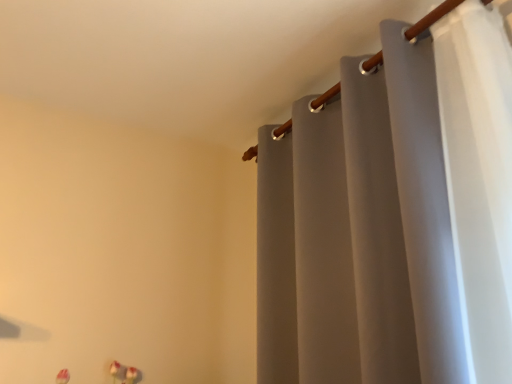
I want to click on matte gray curtain at upper right, so click(x=393, y=213).

Image resolution: width=512 pixels, height=384 pixels. Describe the element at coordinates (393, 213) in the screenshot. I see `matte gray curtain at upper right` at that location.

Where is `matte gray curtain at upper right`? This screenshot has height=384, width=512. matte gray curtain at upper right is located at coordinates (393, 213).